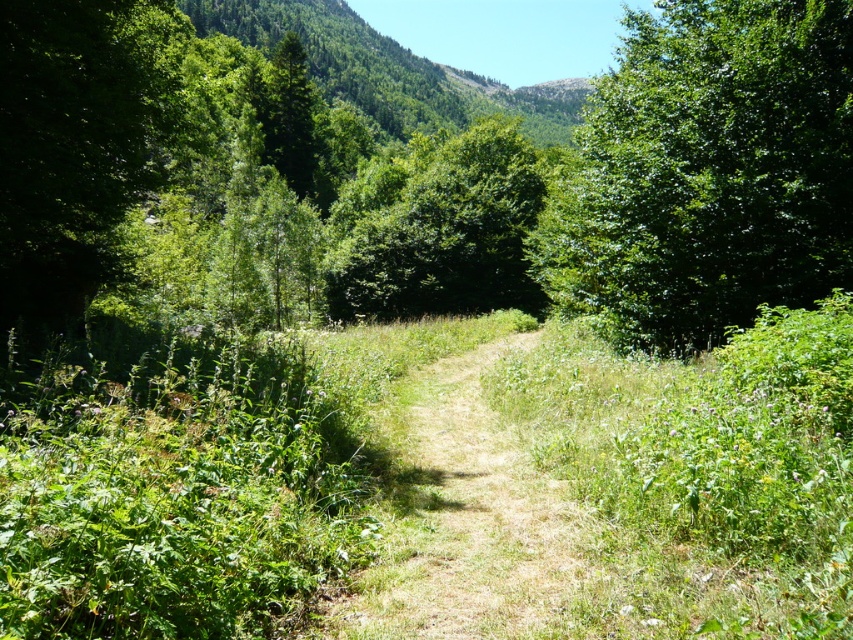
Between point (503, 288) and point (279, 131), which one is positioned in front?

Point (503, 288) is in front.

Can you confirm if green leafy tree at center is thinner than green matte tree at upper center?

Incorrect, green leafy tree at center's width is not less than green matte tree at upper center's.

Is point (384, 244) positioned before point (264, 150)?

Yes, point (384, 244) is closer to viewer.

Find the location of a particular element. The image size is (853, 640). green leafy tree at center is located at coordinates (437, 227).

Is point (566, 577) positioned before point (428, 140)?

That is True.

Is point (606, 595) in front of point (486, 260)?

Yes, it is.

Where is `green grassy trail at center`? green grassy trail at center is located at coordinates (471, 522).

Between point (329, 632) and point (283, 150), which one is positioned in front?

Point (329, 632) is in front.

In the scene shown: Can you confirm if green grassy trail at center is smaller than green matte tree at upper center?

Indeed, green grassy trail at center has a smaller size compared to green matte tree at upper center.

Between point (476, 518) and point (299, 195), which one is positioned in front?

Point (476, 518)

Where is `green grassy trail at center`? This screenshot has width=853, height=640. green grassy trail at center is located at coordinates point(471,522).